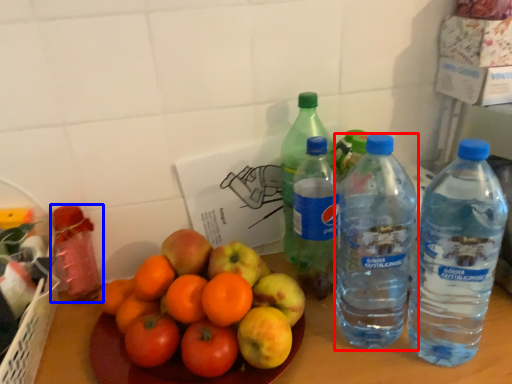
Question: Among these objects, which one is farthest to the camera, bottle (highlighted by a red box) or bottle (highlighted by a blue box)?

Choices:
 (A) bottle
 (B) bottle

Answer: (B)